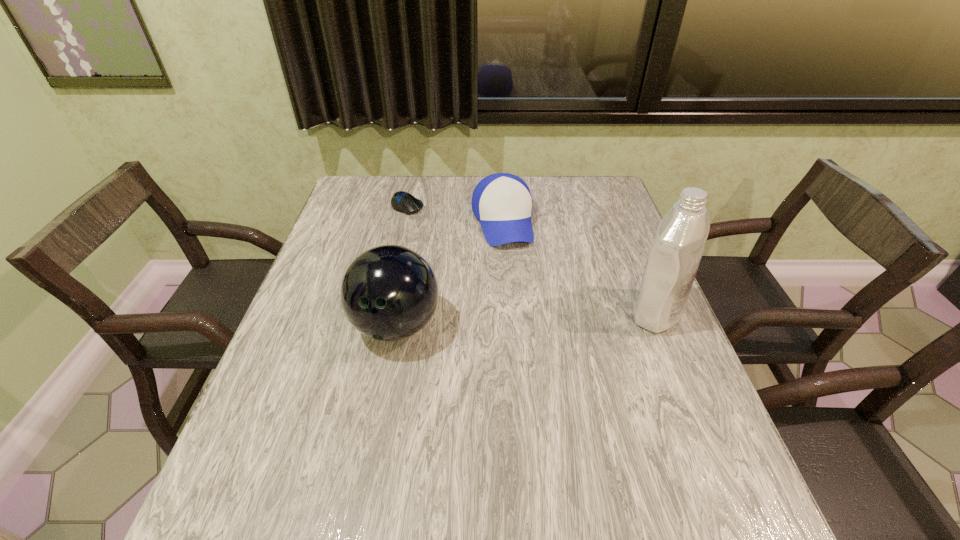
You are a GUI agent. You are given a task and a screenshot of the screen. Output one action in this format:
    pyautogui.click(x=<x>, y=<y>)
    Task: Click on the vacant spot on the desktop that is between the bowling ball and the detergent and is positioned on the front-facing side of the third tallest object
    The image size is (960, 540).
    Given the screenshot: What is the action you would take?
    pyautogui.click(x=526, y=319)

At what (x,y) coordinates should I click in order to perform the action: click on free space on the desktop that is between the bowling ball and the tallest object and is positioned on the button side of the shortest object. Please return your answer as a coordinate pair (x, y). Image resolution: width=960 pixels, height=540 pixels. Looking at the image, I should click on (538, 318).